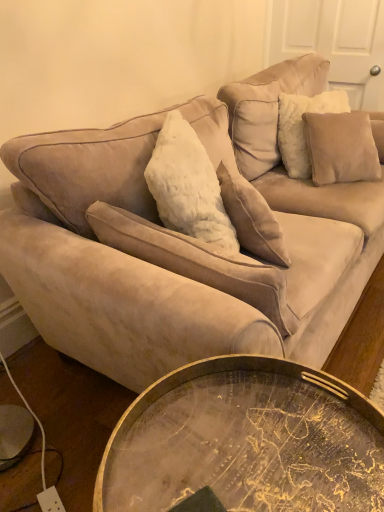
Question: Is gold metallic tray at lower center at the right side of suede beige pillow at upper right, the second pillow from the right?

Choices:
 (A) yes
 (B) no

Answer: (B)

Question: Does gold metallic tray at lower center have a lesser width compared to suede beige pillow at upper right, the second pillow viewed from the left?

Choices:
 (A) yes
 (B) no

Answer: (B)

Question: From a real-world perspective, is gold metallic tray at lower center located beneath suede beige pillow at upper right, the second pillow from the right?

Choices:
 (A) no
 (B) yes

Answer: (B)

Question: Is gold metallic tray at lower center oriented towards suede beige pillow at upper right, arranged as the second pillow when viewed from the back?

Choices:
 (A) yes
 (B) no

Answer: (B)

Question: From a real-world perspective, is gold metallic tray at lower center positioned over suede beige pillow at upper right, the second pillow viewed from the front, based on gravity?

Choices:
 (A) yes
 (B) no

Answer: (B)

Question: Is suede beige couch at upper center in front of or behind suede beige pillow at upper right, which is the 3th pillow from left to right, in the image?

Choices:
 (A) front
 (B) behind

Answer: (A)

Question: Choose the correct answer: Is suede beige couch at upper center inside suede beige pillow at upper right, which is the 3th pillow from left to right, or outside it?

Choices:
 (A) outside
 (B) inside

Answer: (A)

Question: Considering the positions of point (299, 313) and point (326, 139), is point (299, 313) closer or farther from the camera than point (326, 139)?

Choices:
 (A) farther
 (B) closer

Answer: (B)

Question: In terms of height, does suede beige couch at upper center look taller or shorter compared to suede beige pillow at upper right, placed as the 1th pillow when sorted from right to left?

Choices:
 (A) tall
 (B) short

Answer: (A)

Question: Is gold metallic tray at lower center situated inside suede beige pillow at upper right, the second pillow viewed from the left, or outside?

Choices:
 (A) outside
 (B) inside

Answer: (A)

Question: From the image's perspective, is gold metallic tray at lower center above or below suede beige pillow at upper right, the second pillow viewed from the front?

Choices:
 (A) above
 (B) below

Answer: (B)

Question: Considering the positions of gold metallic tray at lower center and suede beige pillow at upper right, the second pillow from the right, in the image, is gold metallic tray at lower center wider or thinner than suede beige pillow at upper right, the second pillow from the right,?

Choices:
 (A) thin
 (B) wide

Answer: (B)

Question: Considering the relative positions of gold metallic tray at lower center and suede beige pillow at upper right, the second pillow from the right, in the image provided, is gold metallic tray at lower center to the left or to the right of suede beige pillow at upper right, the second pillow from the right,?

Choices:
 (A) left
 (B) right

Answer: (A)

Question: Is suede beige pillow at upper right, which is the first pillow from back to front, inside or outside of white fluffy pillow at center, acting as the 1th pillow starting from the left?

Choices:
 (A) inside
 (B) outside

Answer: (B)

Question: Is point (x=334, y=166) closer or farther from the camera than point (x=240, y=186)?

Choices:
 (A) farther
 (B) closer

Answer: (A)